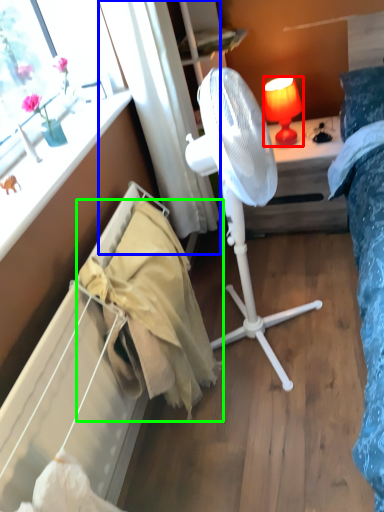
Question: Which object is the farthest from lamp (highlighted by a red box)? Choose among these: curtain (highlighted by a blue box) or blanket (highlighted by a green box).

Choices:
 (A) curtain
 (B) blanket

Answer: (B)